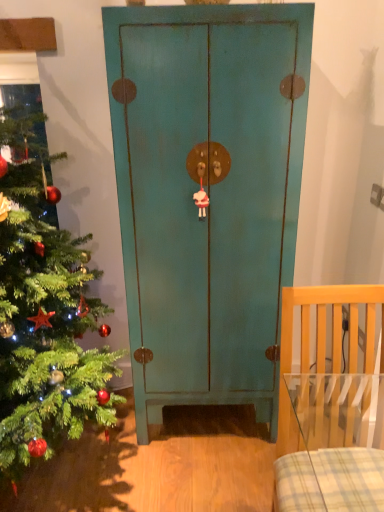
Question: Does teal matte cabinet at center have a smaller size compared to light wood chair at right?

Choices:
 (A) yes
 (B) no

Answer: (B)

Question: Considering the relative sizes of teal matte cabinet at center and light wood chair at right in the image provided, is teal matte cabinet at center thinner than light wood chair at right?

Choices:
 (A) no
 (B) yes

Answer: (B)

Question: Can you confirm if teal matte cabinet at center is shorter than light wood chair at right?

Choices:
 (A) no
 (B) yes

Answer: (A)

Question: Is teal matte cabinet at center aimed at light wood chair at right?

Choices:
 (A) no
 (B) yes

Answer: (B)

Question: From a real-world perspective, is teal matte cabinet at center positioned over light wood chair at right based on gravity?

Choices:
 (A) no
 (B) yes

Answer: (B)

Question: Is teal matte cabinet at center looking in the opposite direction of light wood chair at right?

Choices:
 (A) no
 (B) yes

Answer: (A)

Question: Is teal matte cabinet at center to the left of green matte christmas tree at left from the viewer's perspective?

Choices:
 (A) no
 (B) yes

Answer: (A)

Question: From a real-world perspective, is teal matte cabinet at center positioned over green matte christmas tree at left based on gravity?

Choices:
 (A) no
 (B) yes

Answer: (A)

Question: From the image's perspective, is teal matte cabinet at center beneath green matte christmas tree at left?

Choices:
 (A) yes
 (B) no

Answer: (B)

Question: Would you say teal matte cabinet at center is outside green matte christmas tree at left?

Choices:
 (A) no
 (B) yes

Answer: (B)

Question: Is teal matte cabinet at center not close to green matte christmas tree at left?

Choices:
 (A) no
 (B) yes

Answer: (A)

Question: Does teal matte cabinet at center have a larger size compared to green matte christmas tree at left?

Choices:
 (A) yes
 (B) no

Answer: (B)

Question: Would you say green matte christmas tree at left is a long distance from light wood chair at right?

Choices:
 (A) yes
 (B) no

Answer: (B)